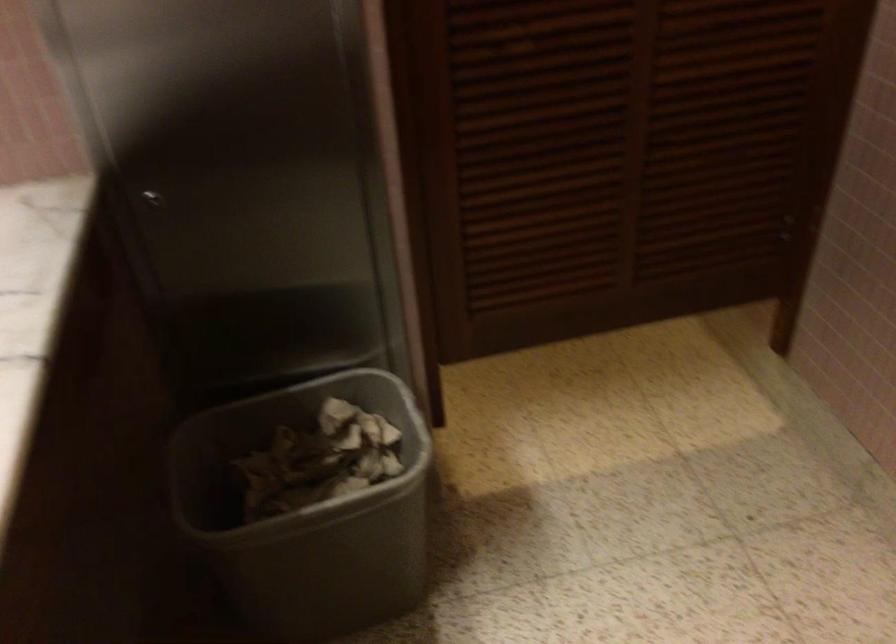
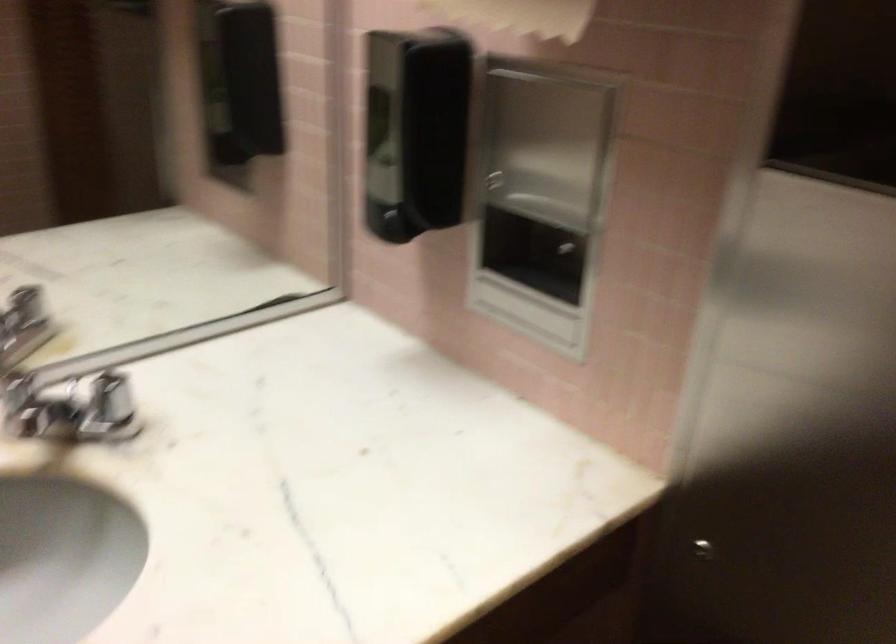
Question: The camera is either moving clockwise (left) or counter-clockwise (right) around the object. The first image is from the beginning of the video and the second image is from the end. Is the camera moving left or right when shooting the video?

Choices:
 (A) Left
 (B) Right

Answer: (B)